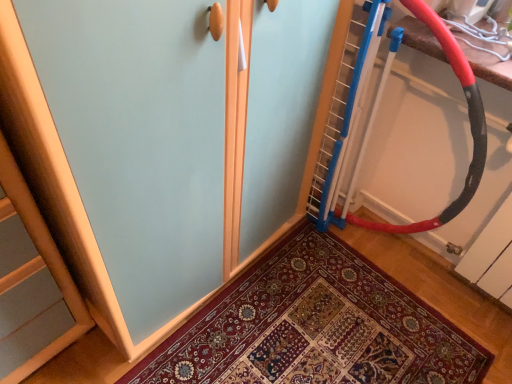
The width and height of the screenshot is (512, 384). I want to click on free space above patterned carpet at center (from a real-world perspective), so click(x=316, y=329).